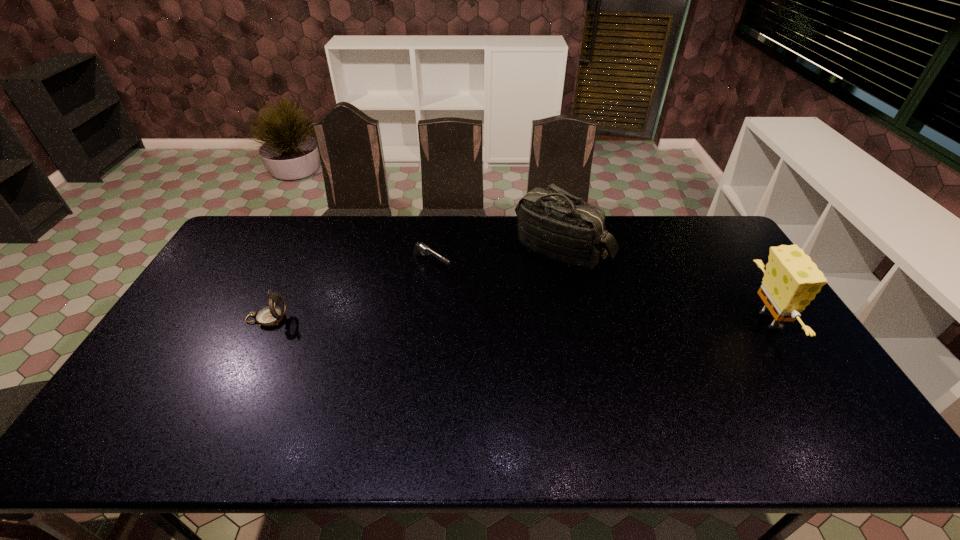
In the image, there is a desktop. At what (x,y) coordinates should I click in order to perform the action: click on vacant space at the far left corner. Please return your answer as a coordinate pair (x, y). This screenshot has height=540, width=960. Looking at the image, I should click on coord(244,231).

At what (x,y) coordinates should I click in order to perform the action: click on free location at the near left corner. Please return your answer as a coordinate pair (x, y). This screenshot has height=540, width=960. Looking at the image, I should click on (128, 408).

You are a GUI agent. You are given a task and a screenshot of the screen. Output one action in this format:
    pyautogui.click(x=<x>, y=<y>)
    Task: Click on the free space between the shortest object and the leftmost object
    The height and width of the screenshot is (540, 960).
    Given the screenshot: What is the action you would take?
    pyautogui.click(x=349, y=292)

At what (x,y) coordinates should I click in order to perform the action: click on free space between the compass and the third object from left to right. Please return your answer as a coordinate pair (x, y). The width and height of the screenshot is (960, 540). Looking at the image, I should click on (415, 285).

This screenshot has height=540, width=960. In order to click on free spot between the shoulder bag and the rightmost object in this screenshot , I will do `click(665, 286)`.

The height and width of the screenshot is (540, 960). What are the coordinates of `free space between the shoulder bag and the rightmost object` in the screenshot? It's located at (665, 286).

This screenshot has height=540, width=960. I want to click on vacant space that's between the shoulder bag and the leftmost object, so click(415, 285).

The height and width of the screenshot is (540, 960). I want to click on free spot between the second object from right to left and the rightmost object, so click(665, 286).

You are a GUI agent. You are given a task and a screenshot of the screen. Output one action in this format:
    pyautogui.click(x=<x>, y=<y>)
    Task: Click on the empty location between the shortest object and the second object from right to left
    This screenshot has width=960, height=540.
    Given the screenshot: What is the action you would take?
    pyautogui.click(x=497, y=258)

This screenshot has width=960, height=540. In order to click on vacant point located between the shoulder bag and the second shortest object in this screenshot , I will do `click(415, 285)`.